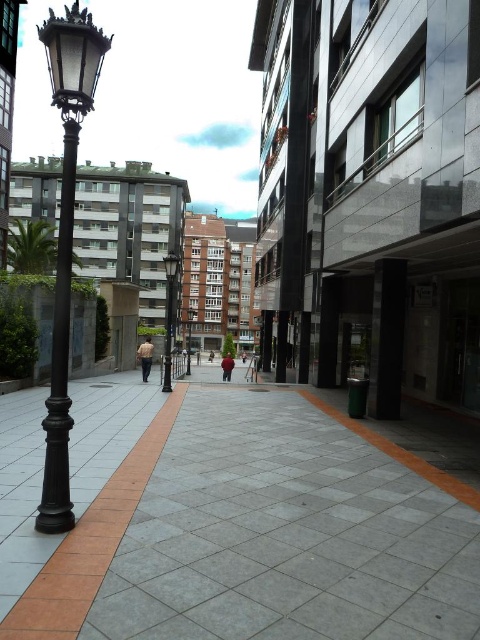
You are a photographer standing on the walkway and see a person wearing a light brown shirt at center and a dark brown leather jacket at center. Which clothing item is higher up on their body?

The light brown shirt at center is taller than the dark brown leather jacket at center, so the shirt is higher up on their body.